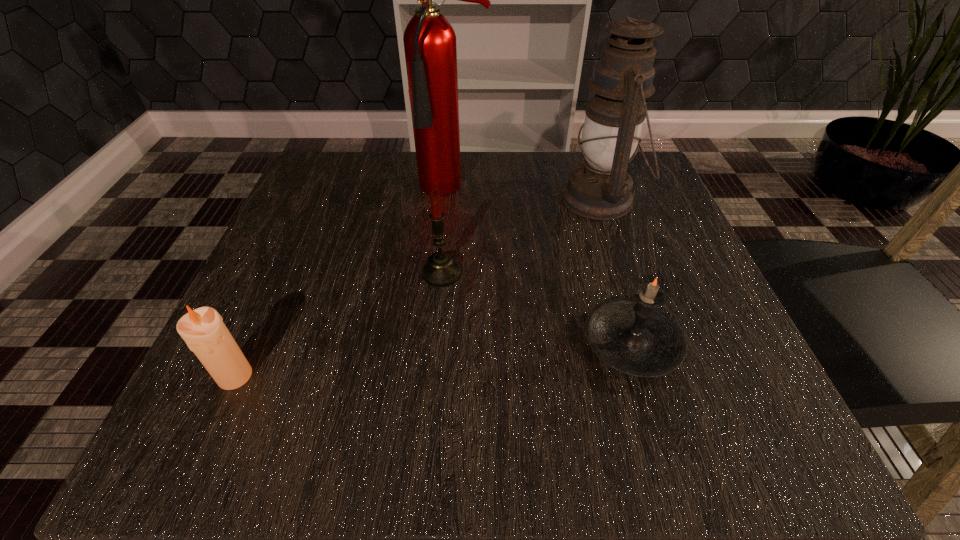
The width and height of the screenshot is (960, 540). Identify the location of vacant point located between the rightmost candle and the leftmost candle. (434, 359).

Locate an element on the screen. This screenshot has width=960, height=540. vacant region between the fourth shortest object and the rightmost candle is located at coordinates (616, 271).

This screenshot has width=960, height=540. What are the coordinates of `vacant space that is in between the second tallest object and the leftmost candle` in the screenshot? It's located at (418, 287).

Locate which object ranks second in proximity to the fire extinguisher. Please provide its 2D coordinates. Your answer should be formatted as a tuple, i.e. [(x, y)], where the tuple contains the x and y coordinates of a point satisfying the conditions above.

[(441, 270)]

This screenshot has height=540, width=960. I want to click on object that is the second closest to the second candle from right to left, so click(635, 336).

Point out which candle is positioned as the nearest to the oil lamp. Please provide its 2D coordinates. Your answer should be formatted as a tuple, i.e. [(x, y)], where the tuple contains the x and y coordinates of a point satisfying the conditions above.

[(635, 336)]

Select which candle is the closest to the second candle from right to left. Please provide its 2D coordinates. Your answer should be formatted as a tuple, i.e. [(x, y)], where the tuple contains the x and y coordinates of a point satisfying the conditions above.

[(635, 336)]

At what (x,y) coordinates should I click in order to perform the action: click on vacant space that satisfies the following two spatial constraints: 1. at the nozzle of the oil lamp; 2. on the left side of the fire extinguisher. Please return your answer as a coordinate pair (x, y). This screenshot has width=960, height=540. Looking at the image, I should click on (452, 199).

Locate an element on the screen. The height and width of the screenshot is (540, 960). vacant area in the image that satisfies the following two spatial constraints: 1. on the back side of the rightmost candle; 2. on the right side of the leftmost object is located at coordinates (251, 343).

At what (x,y) coordinates should I click in order to perform the action: click on free space in the image that satisfies the following two spatial constraints: 1. on the back side of the leftmost object; 2. on the right side of the third nearest object. Please return your answer as a coordinate pair (x, y). This screenshot has height=540, width=960. Looking at the image, I should click on (282, 273).